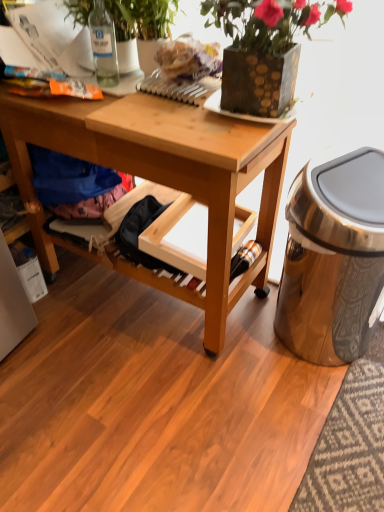
I want to click on vacant area that is in front of polished metallic trash can at right, so [x=314, y=420].